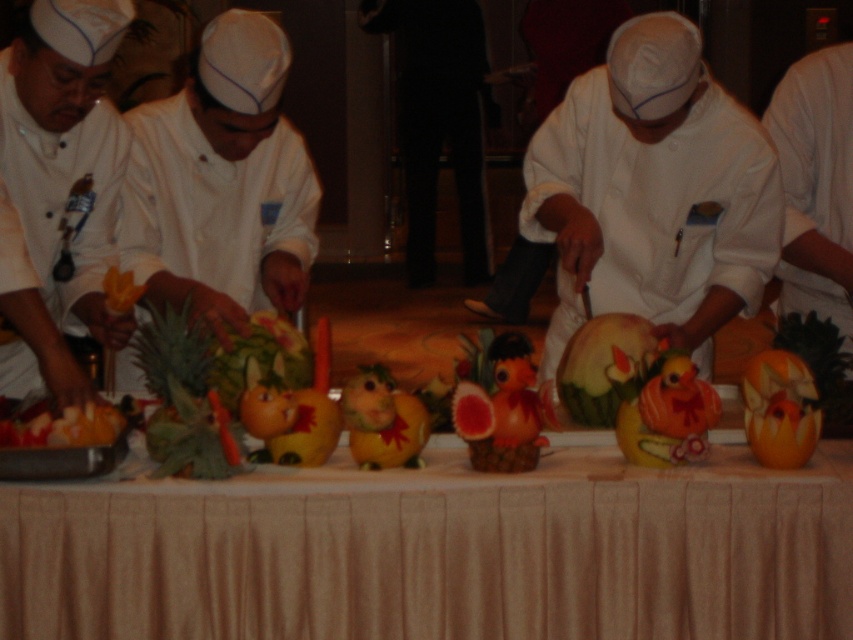
You are a guest at the event and need to place a small gift on the table without blocking the chefs. Given that the white cloth table at center is smaller than the matte white chef at left, will there be enough space on the table to place the gift without interfering with the chef?

The white cloth table at center occupies less space than the matte white chef at left, so placing the gift on the table might be challenging as the table is smaller and the chef is larger, potentially limiting available space. Check the exact dimensions before placing the gift.

You are a food critic standing 5 feet away from the white matte chef coat at center. Can you clearly see the details of the fruit carving being done by the matte white chef at left?

The distance between the white matte chef coat at center and the matte white chef at left is 3.93 feet. Since you are 5 feet away from the white matte chef coat at center, the total distance between you and the matte white chef at left is 8.93 feet. At this distance, it might be difficult to clearly see the intricate details of the fruit carving being done by the matte white chef at left.

You are a photographer standing at the back of the room, and you want to take a closeup photo of the white cloth table at center. The camera you are using has a minimum focusing distance of 2 meters. Can you take the photo without moving closer?

The white cloth table at center is 2.22 meters away from the camera. Since the minimum focusing distance is 2 meters, the camera can focus on the white cloth table at center as it is beyond the minimum required distance.